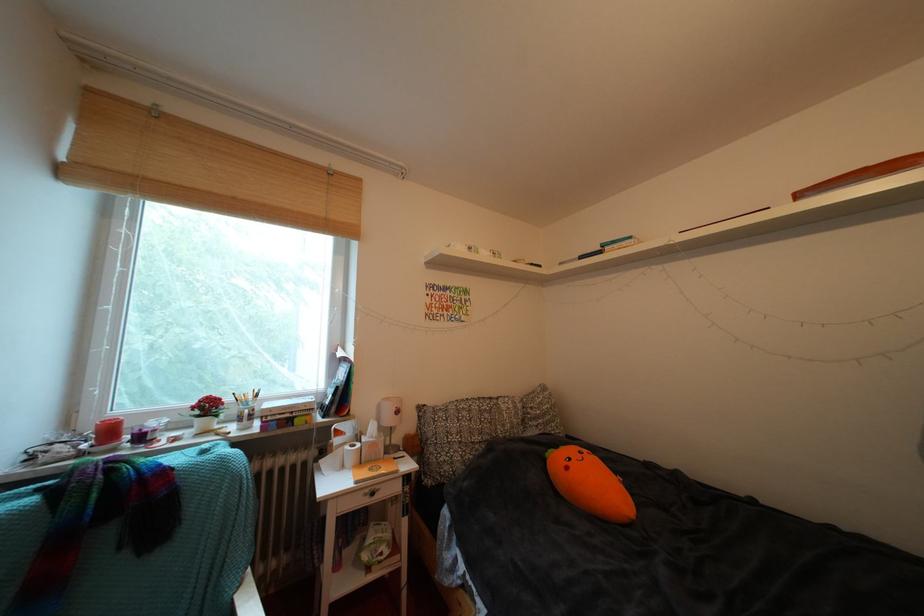
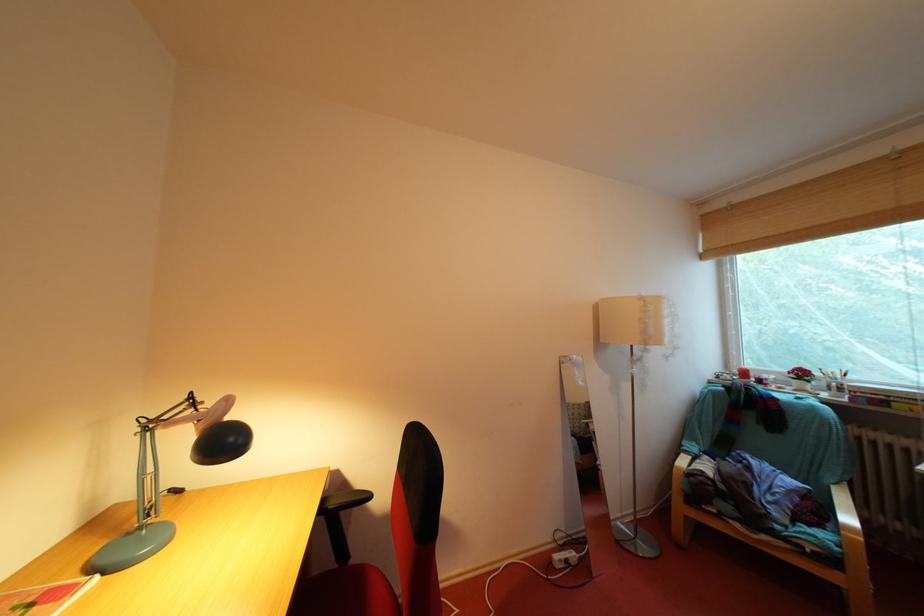
Locate, in the second image, the point that corresponds to point 237,405 in the first image.

(829, 379)